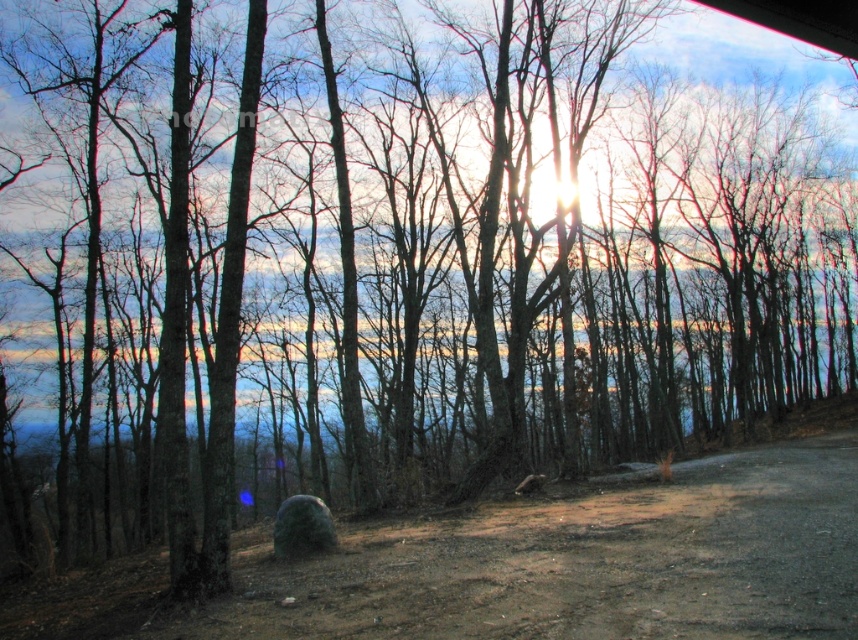
You are standing at the point marked as point (559, 625) and want to walk straight towards the horizon. How far will you have to walk before you reach the horizon?

Since the point marked as point (559, 625) is 6.78 meters away from the horizon, you will have to walk 6.78 meters to reach it.

You are a hiker carrying a heavy backpack and need to move from the green mossy boulder at center to the dull brown dirt track at lower right. What is the shortest distance you must travel?

The shortest distance you must travel from the green mossy boulder at center to the dull brown dirt track at lower right is 4.78 meters.

You are standing at the green mossy boulder at center and want to walk to the dull brown dirt track at lower right. Which direction should you head?

You should head to the right because the dull brown dirt track at lower right is located to the right of the green mossy boulder at center.